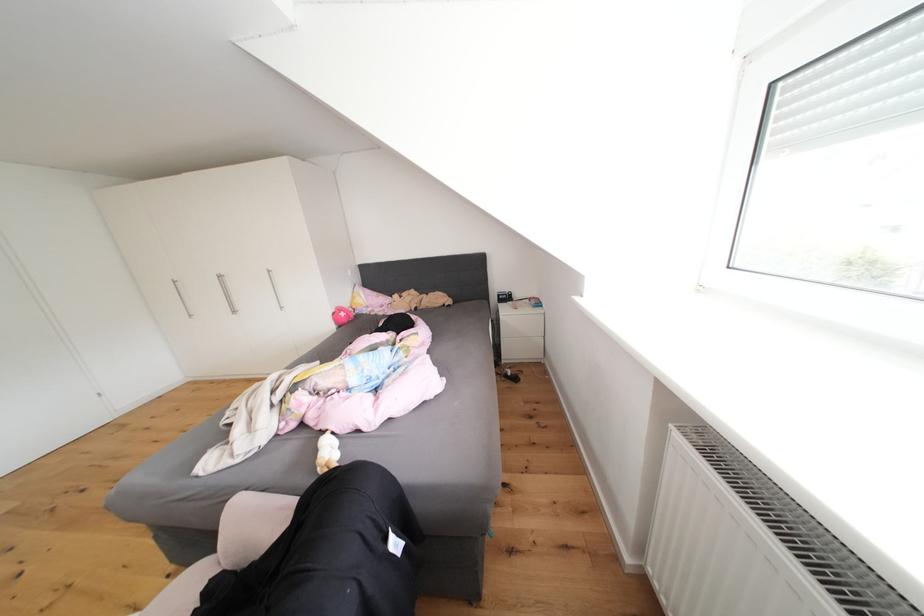
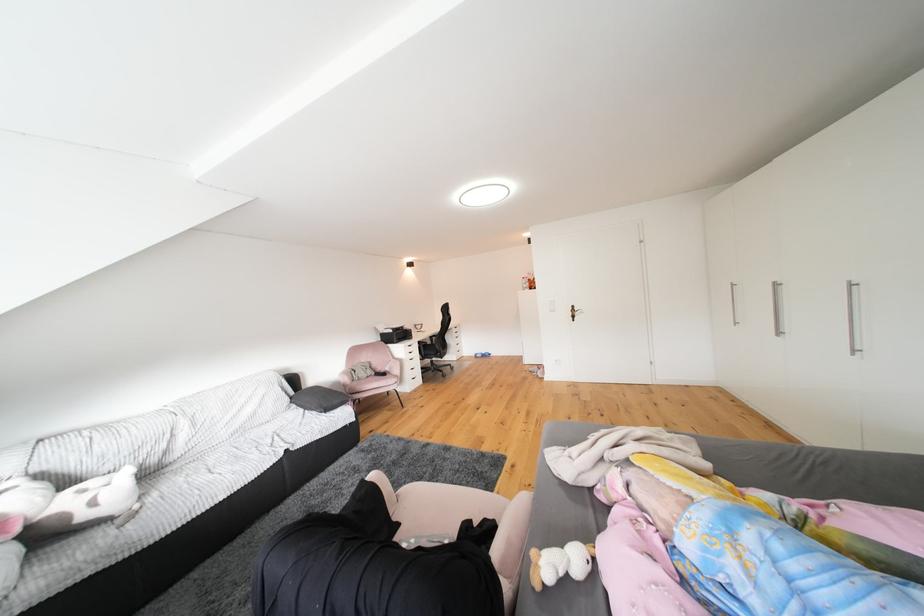
Question: Based on the continuous images, in which direction is the camera rotating? Reply with the corresponding letter.

Choices:
 (A) Left
 (B) Right
 (C) Up
 (D) Down

Answer: (A)